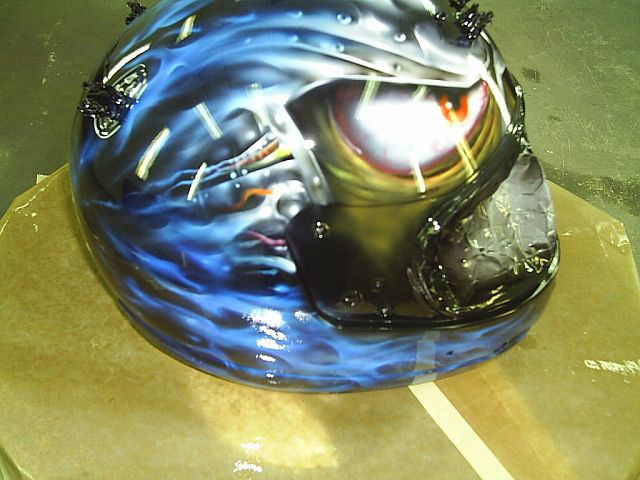
Find the location of a particular element. screws is located at coordinates (317, 227), (349, 292).